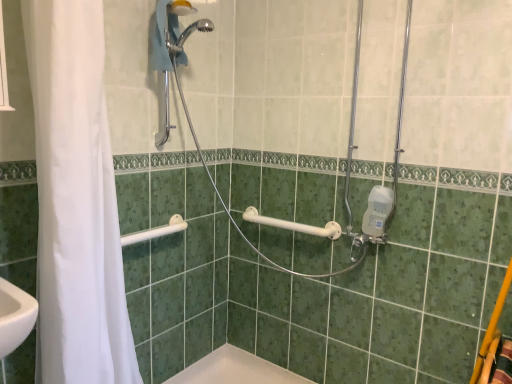
Question: Considering the relative sizes of chrome metallic shower head at upper center, the third shower positioned from the bottom, and white plastic grab bar at upper left, the 1th shower in the bottom-to-top sequence, in the image provided, is chrome metallic shower head at upper center, the third shower positioned from the bottom, shorter than white plastic grab bar at upper left, the 1th shower in the bottom-to-top sequence,?

Choices:
 (A) no
 (B) yes

Answer: (A)

Question: Are chrome metallic shower head at upper center, positioned as the 1th shower in top-to-bottom order, and white plastic grab bar at upper left, the 1th shower in the bottom-to-top sequence, located far from each other?

Choices:
 (A) no
 (B) yes

Answer: (A)

Question: Can you confirm if chrome metallic shower head at upper center, positioned as the 1th shower in top-to-bottom order, is smaller than white plastic grab bar at upper left, the 1th shower in the bottom-to-top sequence?

Choices:
 (A) yes
 (B) no

Answer: (B)

Question: Considering the relative sizes of chrome metallic shower head at upper center, positioned as the 1th shower in top-to-bottom order, and white plastic grab bar at upper left, the 1th shower in the bottom-to-top sequence, in the image provided, is chrome metallic shower head at upper center, positioned as the 1th shower in top-to-bottom order, thinner than white plastic grab bar at upper left, the 1th shower in the bottom-to-top sequence,?

Choices:
 (A) yes
 (B) no

Answer: (B)

Question: Is chrome metallic shower head at upper center, positioned as the 1th shower in top-to-bottom order, further to camera compared to white plastic grab bar at upper left, which is the third shower from top to bottom?

Choices:
 (A) no
 (B) yes

Answer: (A)

Question: Would you say white plastic grab bar at upper left, the 1th shower in the bottom-to-top sequence, is to the left or to the right of metallic silver shower at center, positioned as the second shower in top-to-bottom order, in the picture?

Choices:
 (A) right
 (B) left

Answer: (B)

Question: Is white plastic grab bar at upper left, the 1th shower in the bottom-to-top sequence, inside or outside of metallic silver shower at center, the 2th shower positioned from the bottom?

Choices:
 (A) outside
 (B) inside

Answer: (A)

Question: From the image's perspective, is white plastic grab bar at upper left, the 1th shower in the bottom-to-top sequence, located above or below metallic silver shower at center, the 2th shower positioned from the bottom?

Choices:
 (A) below
 (B) above

Answer: (A)

Question: Considering the positions of white plastic grab bar at upper left, which is the third shower from top to bottom, and metallic silver shower at center, the 2th shower positioned from the bottom, in the image, is white plastic grab bar at upper left, which is the third shower from top to bottom, taller or shorter than metallic silver shower at center, the 2th shower positioned from the bottom,?

Choices:
 (A) short
 (B) tall

Answer: (A)

Question: Is metallic silver shower at center, positioned as the second shower in top-to-bottom order, spatially inside chrome metallic shower head at upper center, the third shower positioned from the bottom, or outside of it?

Choices:
 (A) outside
 (B) inside

Answer: (A)

Question: Looking at their shapes, would you say metallic silver shower at center, the 2th shower positioned from the bottom, is wider or thinner than chrome metallic shower head at upper center, positioned as the 1th shower in top-to-bottom order?

Choices:
 (A) wide
 (B) thin

Answer: (A)

Question: Visually, is metallic silver shower at center, positioned as the second shower in top-to-bottom order, positioned to the left or to the right of chrome metallic shower head at upper center, the third shower positioned from the bottom?

Choices:
 (A) left
 (B) right

Answer: (B)

Question: Is metallic silver shower at center, the 2th shower positioned from the bottom, in front of or behind chrome metallic shower head at upper center, the third shower positioned from the bottom, in the image?

Choices:
 (A) front
 (B) behind

Answer: (A)

Question: Is point (353, 66) closer or farther from the camera than point (168, 221)?

Choices:
 (A) closer
 (B) farther

Answer: (A)

Question: From a real-world perspective, is metallic silver shower at center, positioned as the second shower in top-to-bottom order, physically located above or below white plastic grab bar at upper left, which is the third shower from top to bottom?

Choices:
 (A) below
 (B) above

Answer: (B)